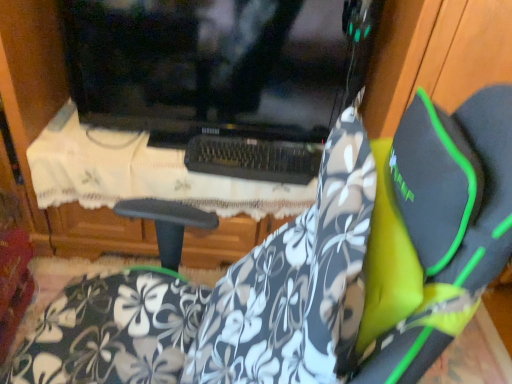
Question: Considering the relative sizes of white lace tablecloth at center and floral-patterned fabric at center in the image provided, is white lace tablecloth at center smaller than floral-patterned fabric at center?

Choices:
 (A) no
 (B) yes

Answer: (A)

Question: Is white lace tablecloth at center directly adjacent to floral-patterned fabric at center?

Choices:
 (A) yes
 (B) no

Answer: (B)

Question: Is white lace tablecloth at center shorter than floral-patterned fabric at center?

Choices:
 (A) no
 (B) yes

Answer: (B)

Question: Can you confirm if white lace tablecloth at center is positioned to the right of floral-patterned fabric at center?

Choices:
 (A) no
 (B) yes

Answer: (A)

Question: Would you consider white lace tablecloth at center to be distant from floral-patterned fabric at center?

Choices:
 (A) yes
 (B) no

Answer: (B)

Question: Is white lace tablecloth at center at the left side of floral-patterned fabric at center?

Choices:
 (A) no
 (B) yes

Answer: (B)

Question: Is floral-patterned fabric at center taller than white lace tablecloth at center?

Choices:
 (A) yes
 (B) no

Answer: (A)

Question: Are floral-patterned fabric at center and white lace tablecloth at center beside each other?

Choices:
 (A) yes
 (B) no

Answer: (B)

Question: Is floral-patterned fabric at center surrounding white lace tablecloth at center?

Choices:
 (A) yes
 (B) no

Answer: (B)

Question: Considering the relative sizes of floral-patterned fabric at center and white lace tablecloth at center in the image provided, is floral-patterned fabric at center wider than white lace tablecloth at center?

Choices:
 (A) yes
 (B) no

Answer: (B)

Question: Considering the relative sizes of floral-patterned fabric at center and white lace tablecloth at center in the image provided, is floral-patterned fabric at center shorter than white lace tablecloth at center?

Choices:
 (A) no
 (B) yes

Answer: (A)

Question: From the image's perspective, does floral-patterned fabric at center appear higher than white lace tablecloth at center?

Choices:
 (A) no
 (B) yes

Answer: (A)

Question: Relative to floral-patterned fabric at center, is white lace tablecloth at center in front or behind?

Choices:
 (A) front
 (B) behind

Answer: (B)